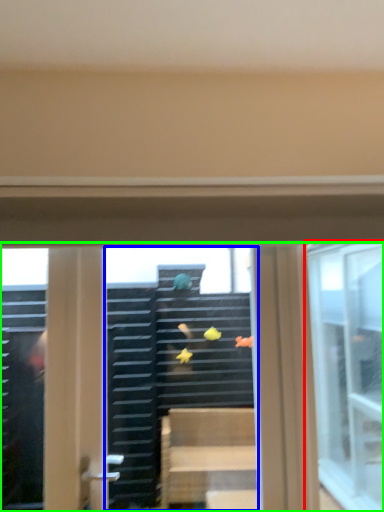
Question: Which object is the closest to the window (highlighted by a red box)? Choose among these: shop window (highlighted by a blue box) or window (highlighted by a green box).

Choices:
 (A) shop window
 (B) window

Answer: (B)